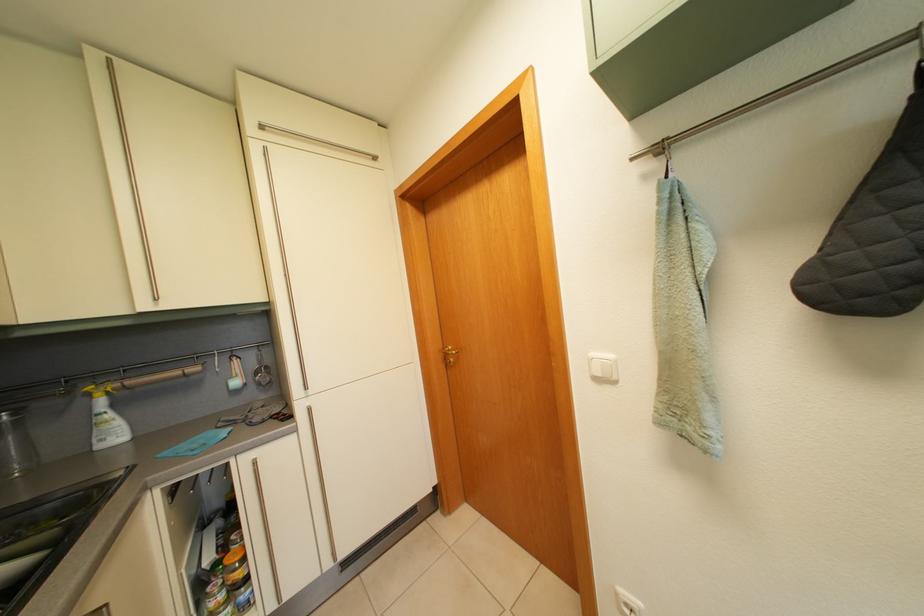
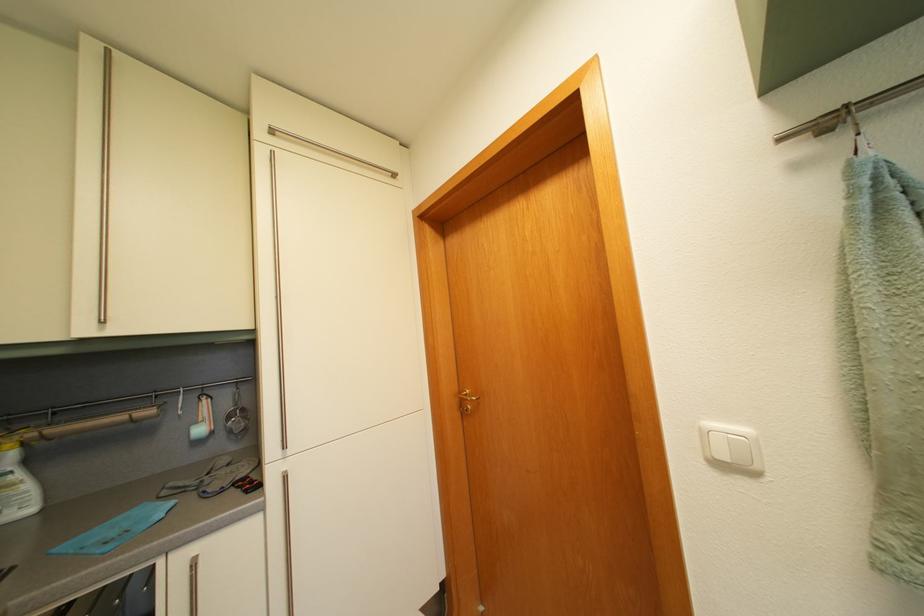
In the second image, find the point that corresponds to point (118, 423) in the first image.

(26, 484)